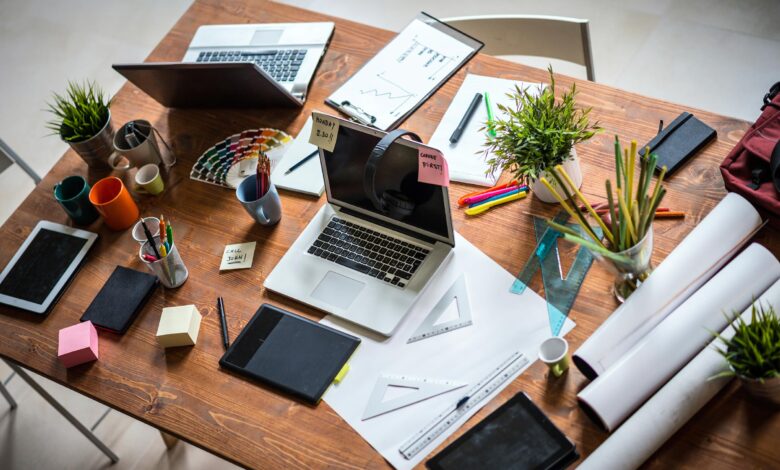
Locate an element on the screen. This screenshot has width=780, height=470. electronics item is located at coordinates (516, 428), (44, 275), (390, 186), (273, 58), (281, 357), (112, 309), (685, 150).